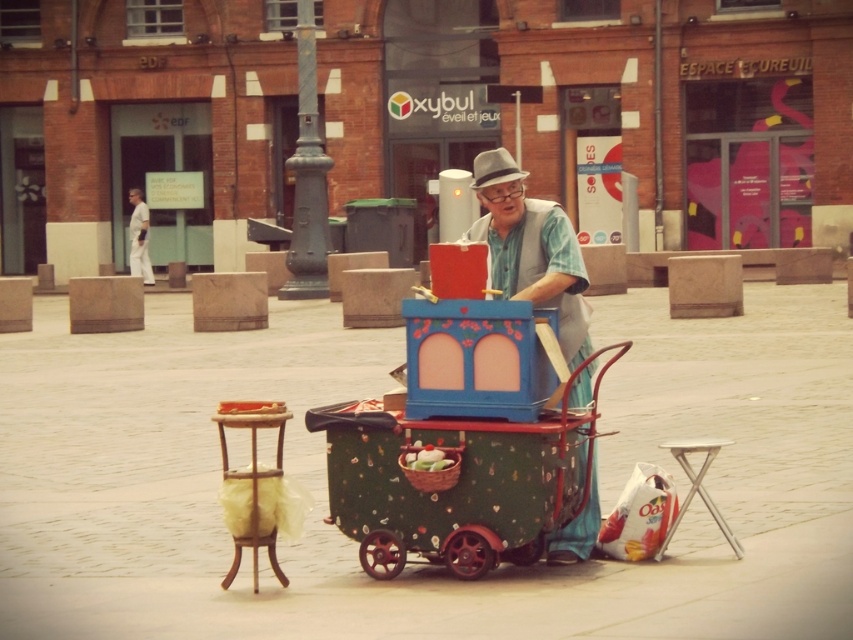
You are a pedestrian walking towards the matte blue cart at center and the white cotton shirt at upper left. Which object will you encounter first?

The matte blue cart at center is in front of the white cotton shirt at upper left, so you will encounter the matte blue cart at center first.

You are a pedestrian walking along the street and see the matte blue cart at center and the gray felt hat at center. Which object is positioned to the left?

The matte blue cart at center is to the left of the gray felt hat at center.

You are a delivery person who needs to place a package that is 1 meter long between the matte blue cart at center and the green woven basket at center. Is there enough space between them to fit the package?

The distance between the matte blue cart at center and the green woven basket at center is 73.64 centimeters, which is shorter than the 1 meter package. Therefore, the package cannot fit between them.